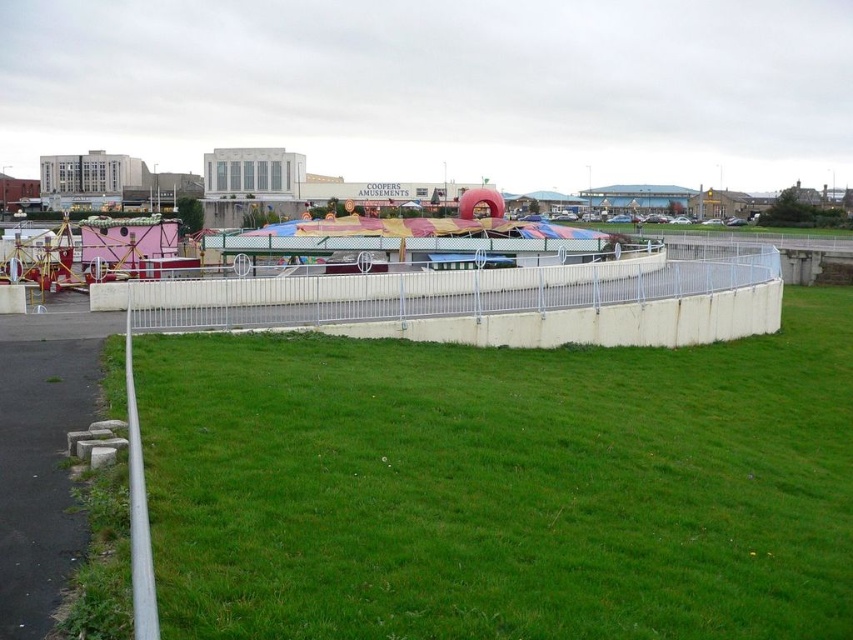
You are standing at point (502, 484) in the fairground. What is the terrain like under your feet?

The terrain at point (502, 484) is green grass at center.

You are planning to set up a small booth for a game at the fairground. The booth requires a space of 50 feet. You see the green grass at center and the multicolored fabric carousel at center. Can you place the booth between them without overlapping either?

The distance between the green grass at center and the multicolored fabric carousel at center is 56.54 feet. Since the required space is 50 feet, there is enough room to place the booth between them without overlapping either.

You are standing at the entrance of the amusement park and see the green grass at center and the multicolored fabric carousel at center. Which object is located to the right of the other?

The green grass at center is positioned on the right side of multicolored fabric carousel at center, so the green grass at center is to the right of the multicolored fabric carousel at center.